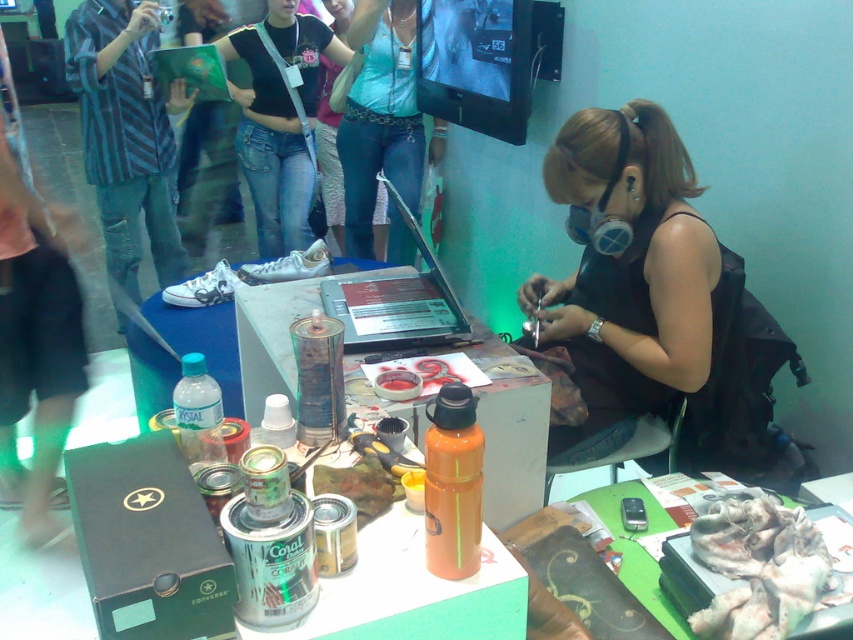
You are organizing a small exhibition and need to place the blue denim jeans at center and the fuzzy white fabric at lower right on a shelf. If the shelf has a maximum width capacity of 1 meter, which item would you place first to ensure both can fit?

The fuzzy white fabric at lower right should be placed first since it is narrower than the blue denim jeans at center. This way, both items can fit on the 1 meter shelf as the total width required would be less than the maximum capacity.

You are standing in front of the table and want to see both the matte black tank top at center and the blue denim jeans at center. Which one is closer to you?

The matte black tank top at center is closer to you because it is in front of the blue denim jeans at center.

Looking at this image, what is the position of the blue denim jeans at center?

The blue denim jeans at center is located at point (x=379, y=116).